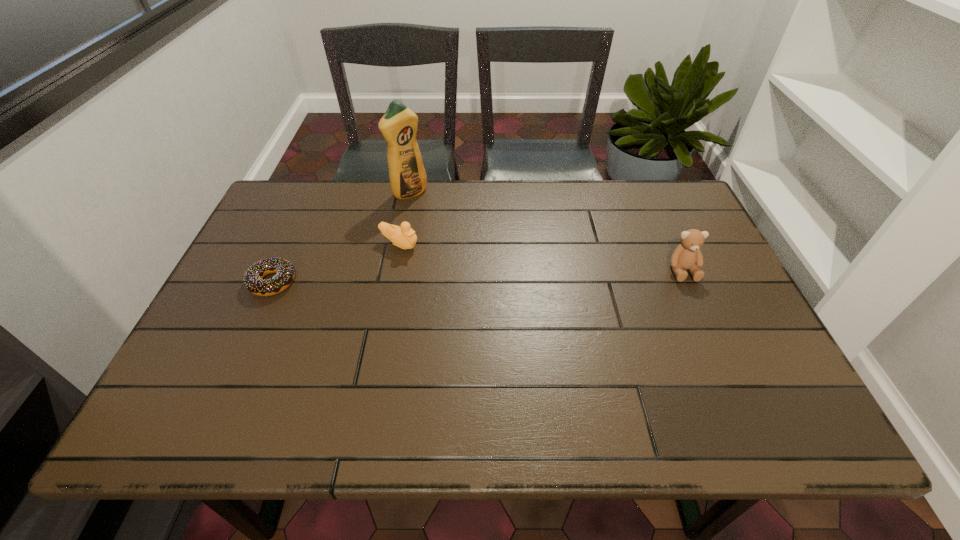
You are a GUI agent. You are given a task and a screenshot of the screen. Output one action in this format:
    pyautogui.click(x=<x>, y=<y>)
    Task: Click on the vacant spot on the desktop that is between the doughnut and the teddy bear and is positioned on the face of the third nearest object
    
    Given the screenshot: What is the action you would take?
    pyautogui.click(x=477, y=276)

Identify the location of free space on the desktop that is between the shortest object and the rightmost object and is positioned on the label of the tallest object. pyautogui.click(x=501, y=275).